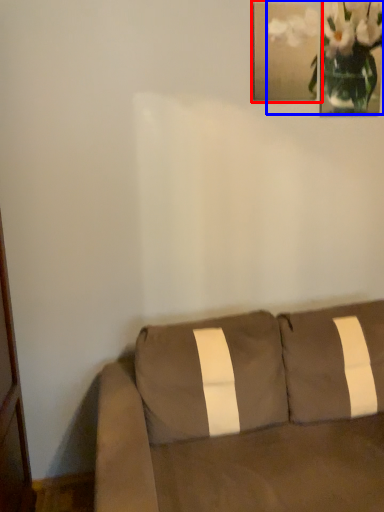
Question: Among these objects, which one is farthest to the camera, picture frame (highlighted by a red box) or floral arrangement (highlighted by a blue box)?

Choices:
 (A) picture frame
 (B) floral arrangement

Answer: (B)